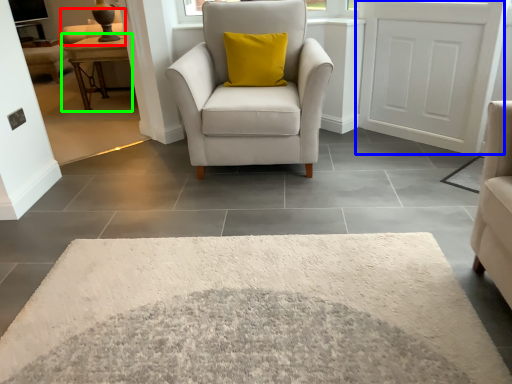
Question: Considering the real-world distances, which object is closest to couch (highlighted by a red box)? door (highlighted by a blue box) or table (highlighted by a green box).

Choices:
 (A) door
 (B) table

Answer: (B)